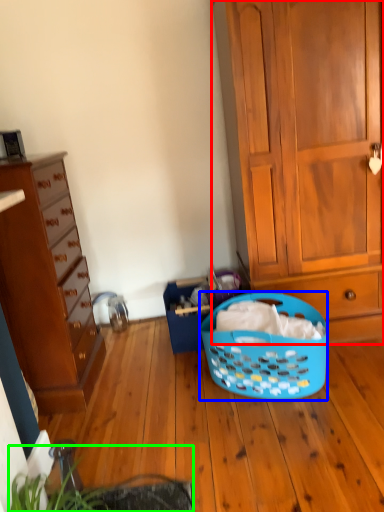
Question: Which object is the farthest from cabinetry (highlighted by a red box)? Choose among these: picnic basket (highlighted by a blue box) or plant (highlighted by a green box).

Choices:
 (A) picnic basket
 (B) plant

Answer: (B)